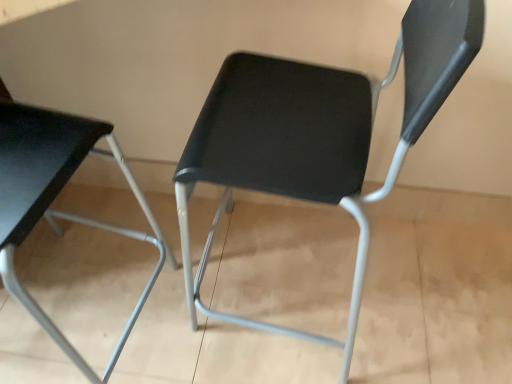
Question: From a real-world perspective, is matte black chair at center, positioned as the 2th chair in left-to-right order, beneath matte black chair at left, arranged as the 1th chair when viewed from the left?

Choices:
 (A) no
 (B) yes

Answer: (B)

Question: Is matte black chair at center, the first chair in the right-to-left sequence, bigger than matte black chair at left, which is counted as the 2th chair, starting from the right?

Choices:
 (A) no
 (B) yes

Answer: (A)

Question: Is matte black chair at center, the first chair in the right-to-left sequence, positioned with its back to matte black chair at left, which is counted as the 2th chair, starting from the right?

Choices:
 (A) yes
 (B) no

Answer: (B)

Question: From the image's perspective, would you say matte black chair at center, positioned as the 2th chair in left-to-right order, is positioned over matte black chair at left, arranged as the 1th chair when viewed from the left?

Choices:
 (A) no
 (B) yes

Answer: (B)

Question: Does matte black chair at center, positioned as the 2th chair in left-to-right order, turn towards matte black chair at left, arranged as the 1th chair when viewed from the left?

Choices:
 (A) no
 (B) yes

Answer: (B)

Question: From a real-world perspective, is matte black chair at center, the first chair in the right-to-left sequence, positioned over matte black chair at left, which is counted as the 2th chair, starting from the right, based on gravity?

Choices:
 (A) yes
 (B) no

Answer: (B)

Question: Can you confirm if matte black chair at left, which is counted as the 2th chair, starting from the right, is positioned to the right of matte black chair at center, positioned as the 2th chair in left-to-right order?

Choices:
 (A) yes
 (B) no

Answer: (B)

Question: Is matte black chair at left, arranged as the 1th chair when viewed from the left, facing away from matte black chair at center, positioned as the 2th chair in left-to-right order?

Choices:
 (A) yes
 (B) no

Answer: (B)

Question: Would you consider matte black chair at left, which is counted as the 2th chair, starting from the right, to be distant from matte black chair at center, positioned as the 2th chair in left-to-right order?

Choices:
 (A) yes
 (B) no

Answer: (B)

Question: Is matte black chair at left, arranged as the 1th chair when viewed from the left, to the left of matte black chair at center, positioned as the 2th chair in left-to-right order, from the viewer's perspective?

Choices:
 (A) no
 (B) yes

Answer: (B)

Question: From the image's perspective, is matte black chair at left, which is counted as the 2th chair, starting from the right, below matte black chair at center, positioned as the 2th chair in left-to-right order?

Choices:
 (A) no
 (B) yes

Answer: (B)

Question: Does matte black chair at left, arranged as the 1th chair when viewed from the left, have a larger size compared to matte black chair at center, the first chair in the right-to-left sequence?

Choices:
 (A) no
 (B) yes

Answer: (B)

Question: Considering the relative positions of matte black chair at left, arranged as the 1th chair when viewed from the left, and matte black chair at center, positioned as the 2th chair in left-to-right order, in the image provided, is matte black chair at left, arranged as the 1th chair when viewed from the left, to the left or to the right of matte black chair at center, positioned as the 2th chair in left-to-right order,?

Choices:
 (A) right
 (B) left

Answer: (B)